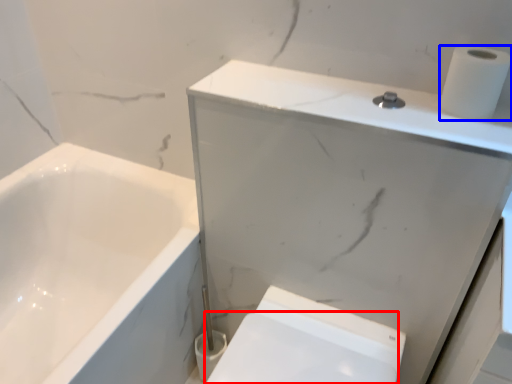
Question: Which point is further to the camera, bidet (highlighted by a red box) or toilet paper (highlighted by a blue box)?

Choices:
 (A) bidet
 (B) toilet paper

Answer: (A)